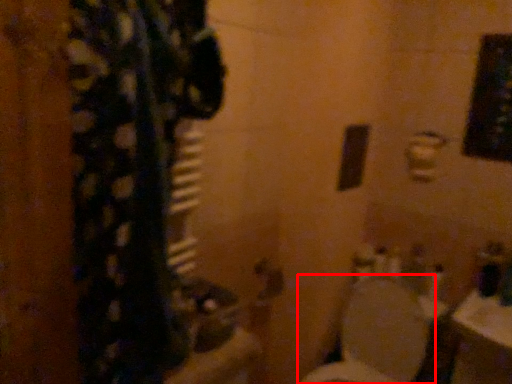
Question: From the image's perspective, where is toilet (annotated by the red box) located relative to door handle?

Choices:
 (A) below
 (B) above

Answer: (A)